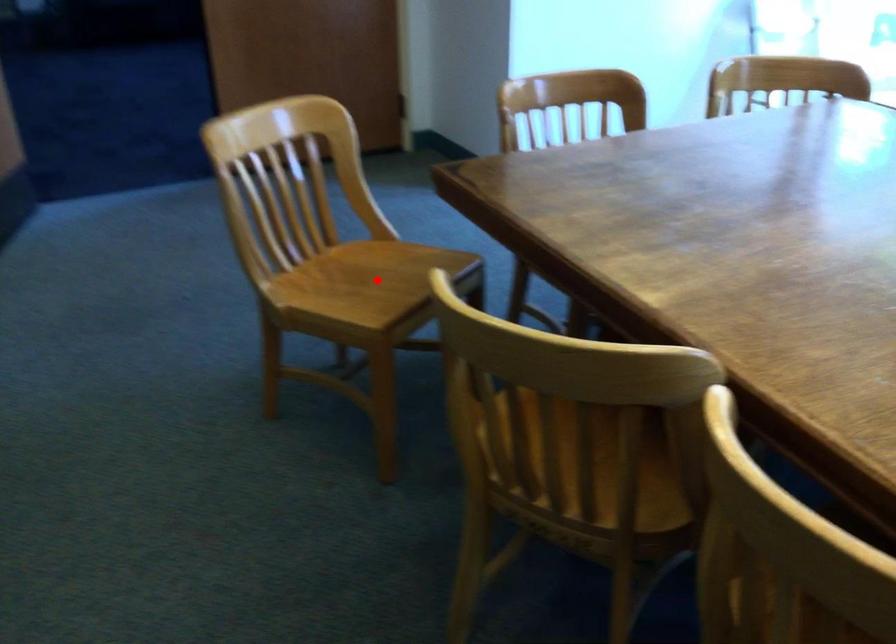
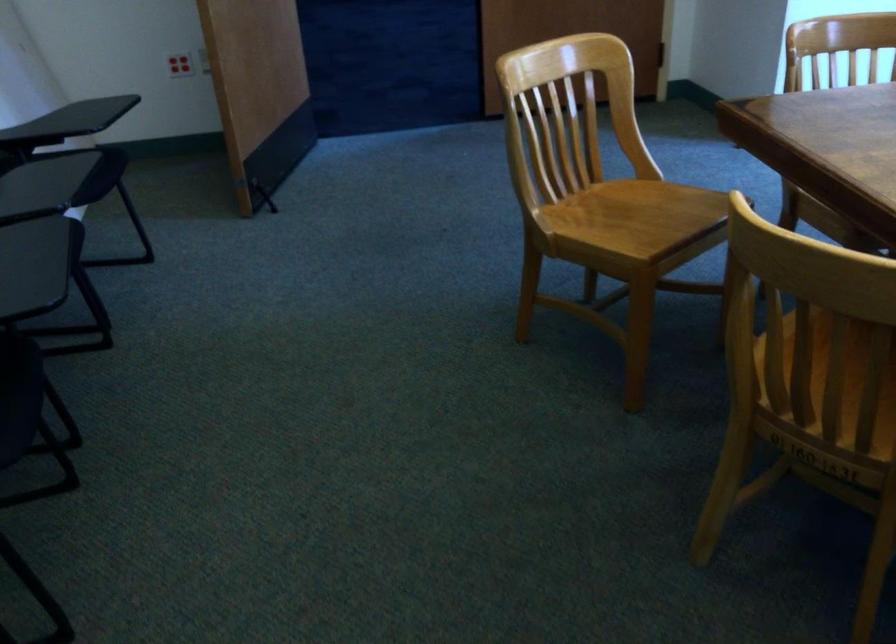
Question: I am providing you with two images of the same scene from different viewpoints. A red point is marked on the first image. Is the red point's position out of view in image 2?

Choices:
 (A) Yes
 (B) No

Answer: (B)